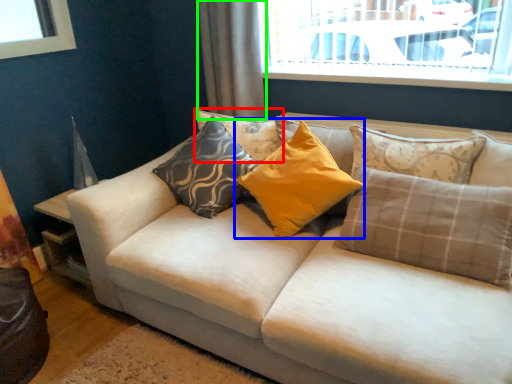
Question: Considering the real-world distances, which object is closest to pillow (highlighted by a red box)? pillow (highlighted by a blue box) or curtain (highlighted by a green box).

Choices:
 (A) pillow
 (B) curtain

Answer: (A)